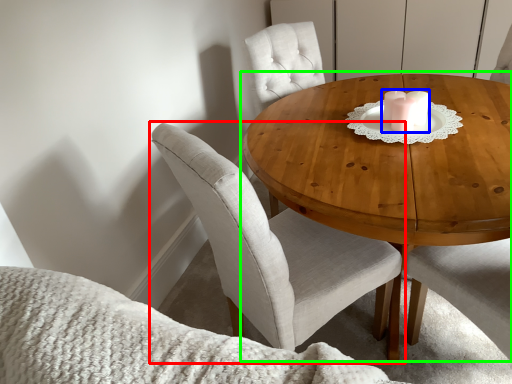
Question: Based on their relative distances, which object is farther from chair (highlighted by a red box)? Choose from candle holder (highlighted by a blue box) and coffee table (highlighted by a green box).

Choices:
 (A) candle holder
 (B) coffee table

Answer: (A)